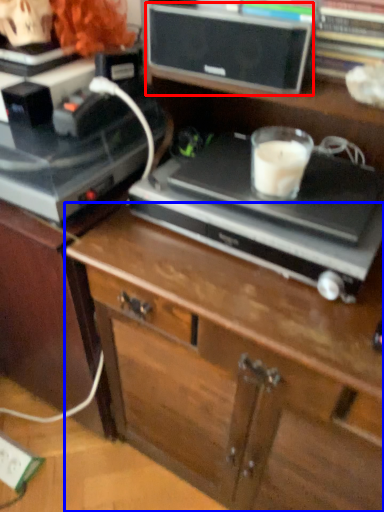
Question: Which of the following is the closest to the observer, speaker (highlighted by a red box) or chest of drawers (highlighted by a blue box)?

Choices:
 (A) speaker
 (B) chest of drawers

Answer: (B)